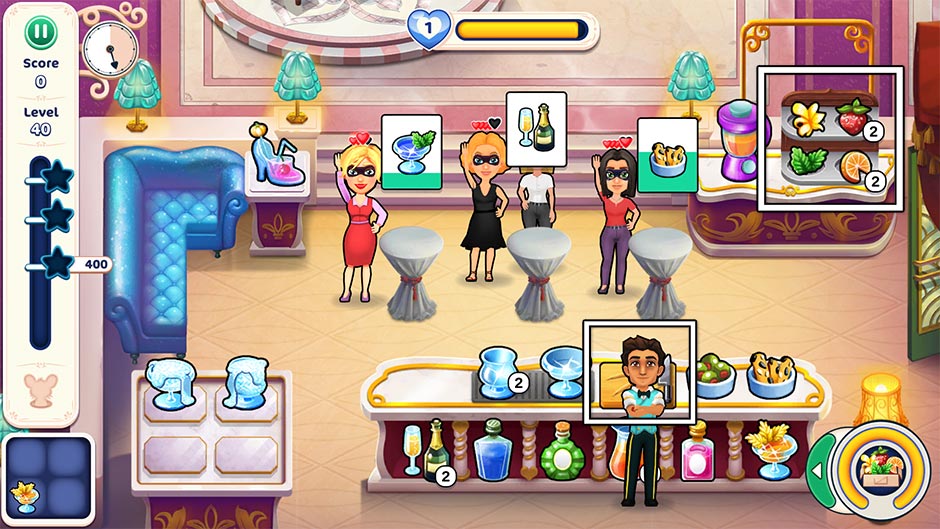
Image resolution: width=940 pixels, height=529 pixels. Identify the location of blue lamp shades. (141, 99), (298, 88), (684, 84).